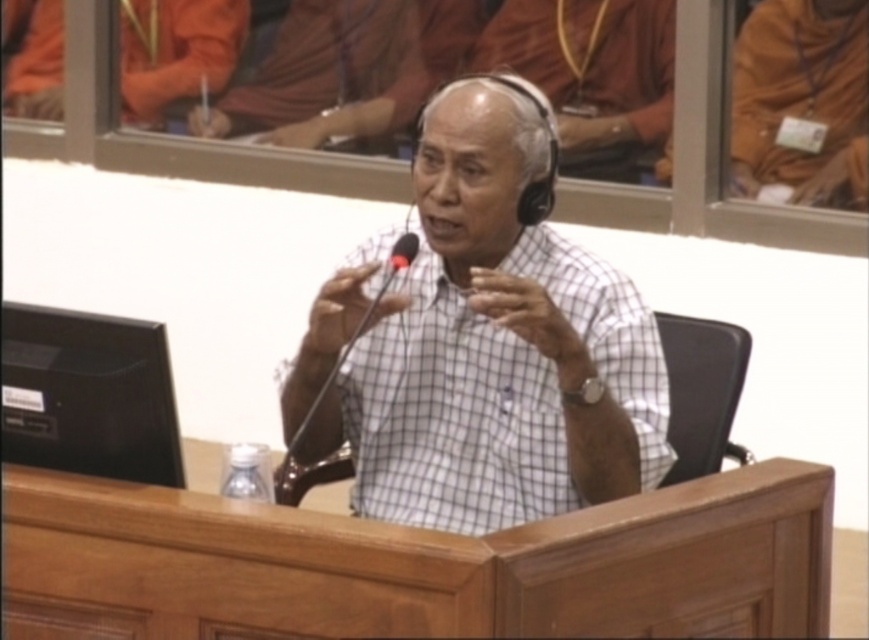
This screenshot has height=640, width=869. Find the location of `white matte headphones at upper center`. white matte headphones at upper center is located at coordinates (594, 76).

Is point (569, 128) in front of point (415, 243)?

No, it is not.

Locate an element on the screen. white matte headphones at upper center is located at coordinates (594, 76).

Looking at this image, does orange cloth at upper left appear under black matte microphone at center?

Incorrect, orange cloth at upper left is not positioned below black matte microphone at center.

Who is taller, orange cloth at upper left or black matte microphone at center?

orange cloth at upper left

I want to click on orange cloth at upper left, so click(176, 51).

Can you confirm if white checkered shirt at center is positioned to the left of black plastic microphone at center?

In fact, white checkered shirt at center is to the right of black plastic microphone at center.

Can you confirm if white checkered shirt at center is positioned below black plastic microphone at center?

Actually, white checkered shirt at center is above black plastic microphone at center.

Does point (481, 321) come farther from viewer compared to point (303, 493)?

No, it is not.

This screenshot has width=869, height=640. In order to click on white checkered shirt at center in this screenshot , I will do `click(495, 346)`.